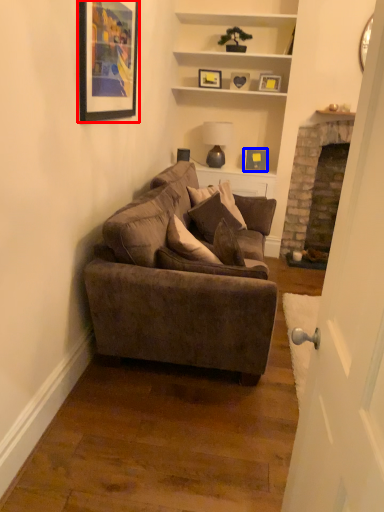
Question: Among these objects, which one is farthest to the camera, picture frame (highlighted by a red box) or picture frame (highlighted by a blue box)?

Choices:
 (A) picture frame
 (B) picture frame

Answer: (B)